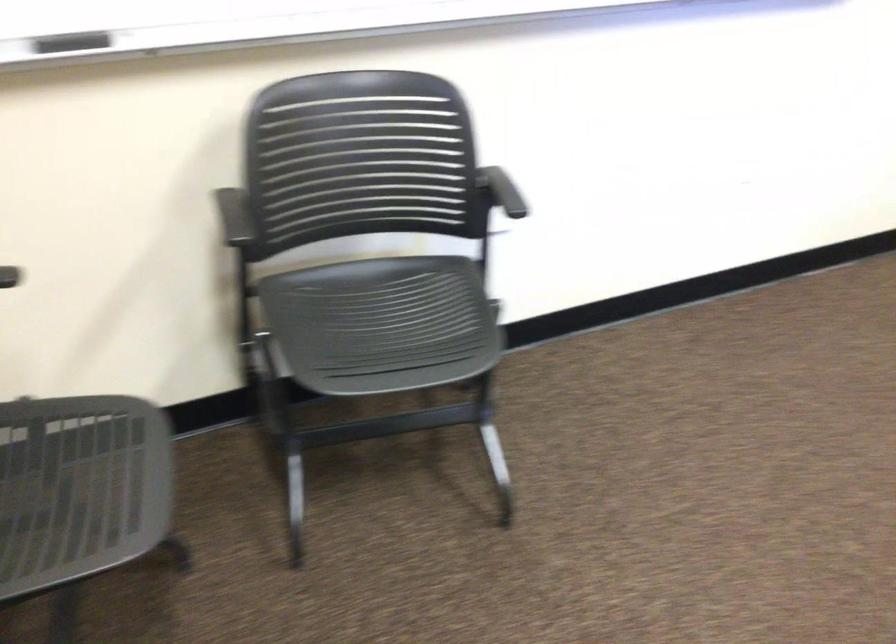
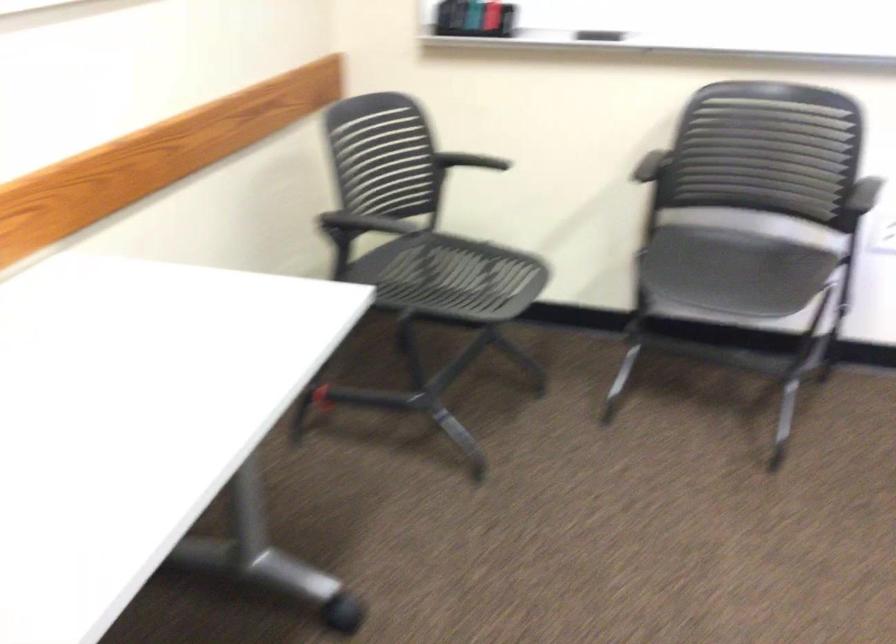
The point at (375, 319) is marked in the first image. Where is the corresponding point in the second image?

(731, 270)